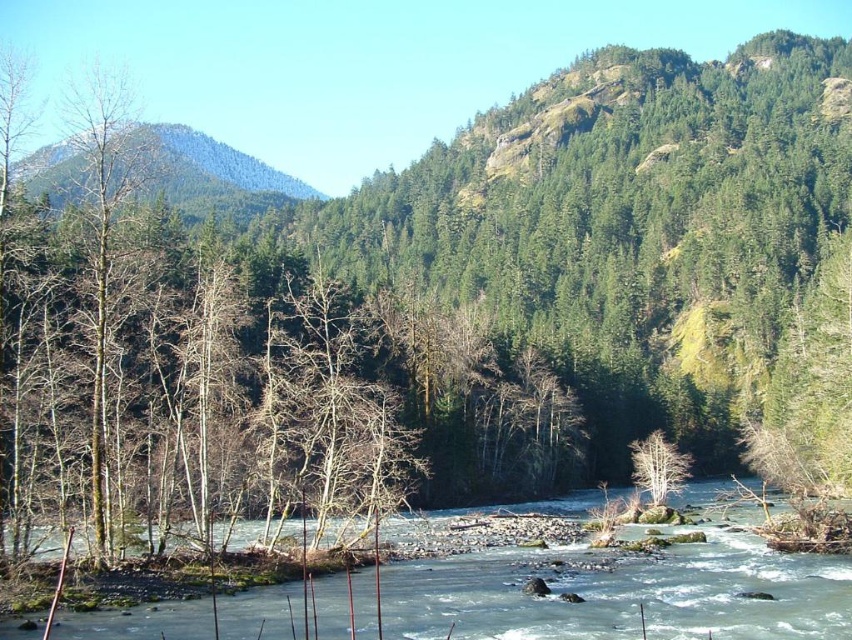
You are standing at the riverbank and want to take a photo of the green forested mountain at upper left and the white matte tree at center. Which object is positioned to the left of the other?

The green forested mountain at upper left is to the left of the white matte tree at center.

You are standing at the riverbank in the image and want to reach both the point at coordinates point (x=815, y=614) and the point at coordinates point (x=302, y=196). Which point will you reach first if you walk straight towards them?

You will reach point (x=815, y=614) first because it is closer to you than point (x=302, y=196).